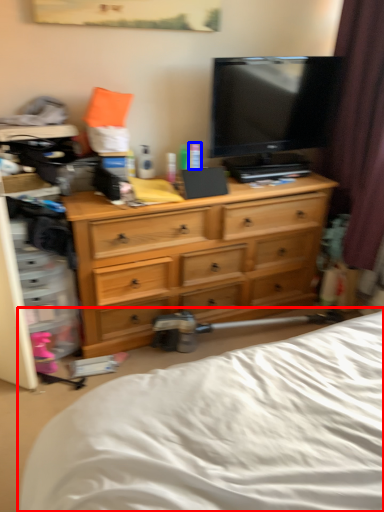
Question: Which of the following is the farthest to the observer, bed (highlighted by a red box) or toiletry (highlighted by a blue box)?

Choices:
 (A) bed
 (B) toiletry

Answer: (B)